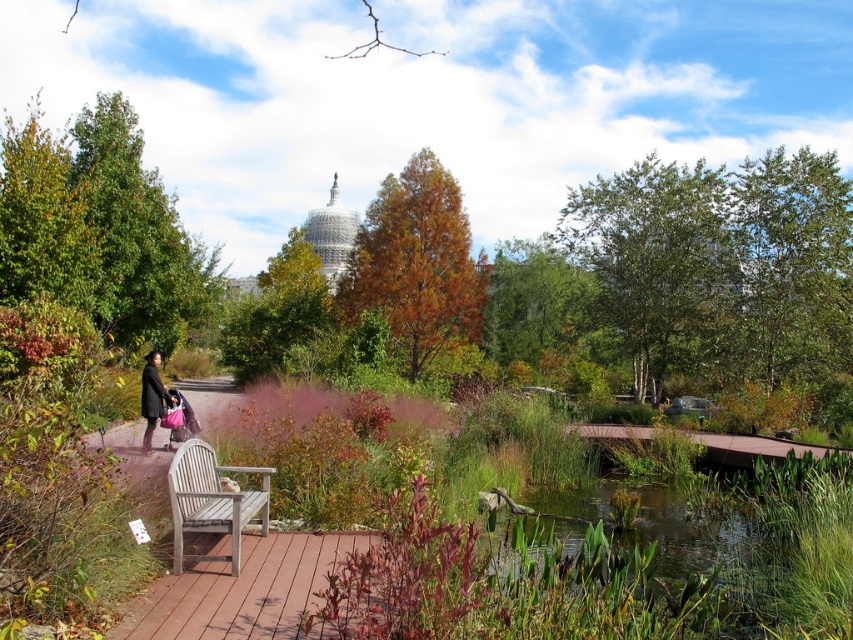
You are standing at the camera position observing the scene. There are two points marked in the image, point (699, 483) and point (566, 323). Which point is nearer to you?

Point (699, 483) is closer to the camera than point (566, 323).

Based on the scene description, can you determine the 2D coordinates of the green leafy tree at upper right in the image?

The 2D coordinates of the green leafy tree at upper right are at point (657, 262).

You are a gardener who wants to plant a new flower bed between the green leafy pond at center and the green leafy tree at center. Which object should you consider for the height difference to ensure proper sunlight for the flowers?

The green leafy tree at center is taller than the green leafy pond at center. Therefore, you should consider the height of the green leafy tree at center when planning the flower bed to ensure the flowers receive adequate sunlight by positioning them where they can get enough light without being overshadowed.